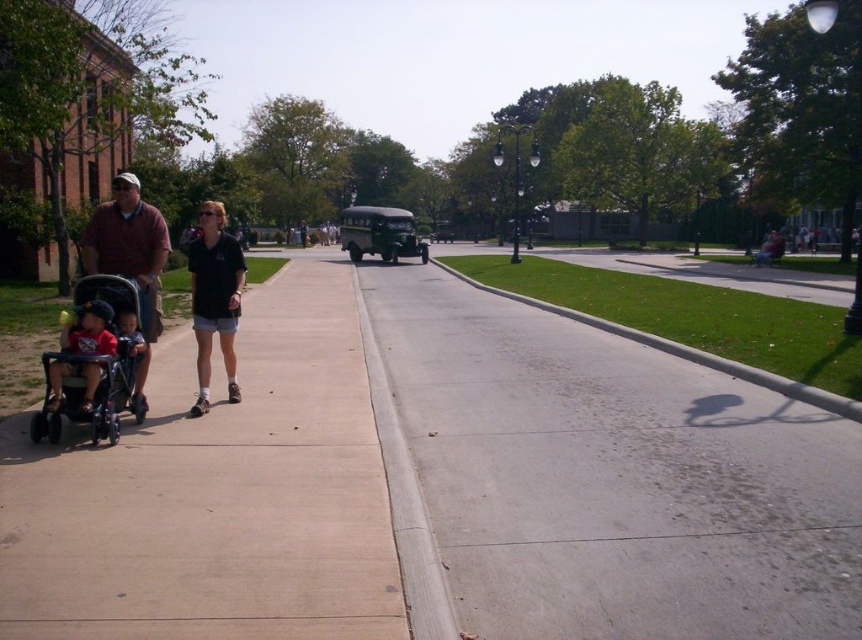
Question: Is the position of black matte shirt at center more distant than that of matte blue shirt at left?

Choices:
 (A) no
 (B) yes

Answer: (B)

Question: Which object is the closest to the gray concrete sidewalk at center?

Choices:
 (A) matte brown shirt at left
 (B) smooth concrete sidewalk at left
 (C) matte black baby stroller at left
 (D) black matte shirt at center

Answer: (B)

Question: Can you confirm if black matte shirt at center is wider than matte black baby stroller at left?

Choices:
 (A) yes
 (B) no

Answer: (A)

Question: Which object is positioned closest to the gray concrete curb at lower center?

Choices:
 (A) matte blue shirt at left
 (B) matte black baby stroller at left
 (C) black matte shirt at center
 (D) smooth concrete sidewalk at left

Answer: (D)

Question: Among these objects, which one is nearest to the camera?

Choices:
 (A) matte brown shirt at left
 (B) matte blue shirt at left

Answer: (B)

Question: Is black plastic stroller at left bigger than gray concrete curb at lower center?

Choices:
 (A) no
 (B) yes

Answer: (A)